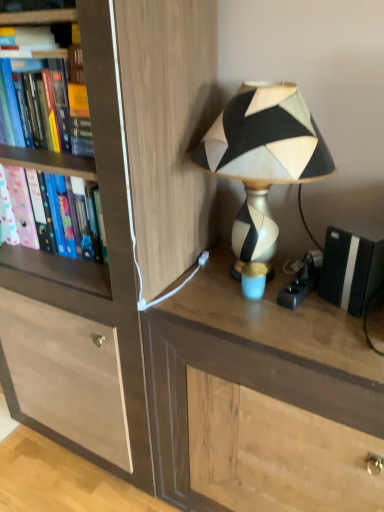
Where is `empty space that is ontop of brown wood desk at center (from a real-world perspective)`? Image resolution: width=384 pixels, height=512 pixels. empty space that is ontop of brown wood desk at center (from a real-world perspective) is located at coordinates (280, 307).